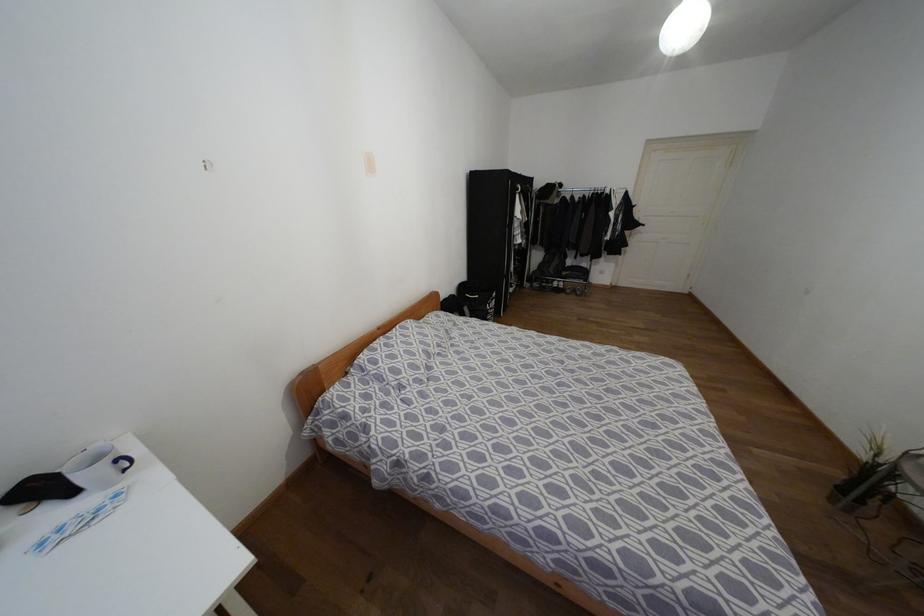
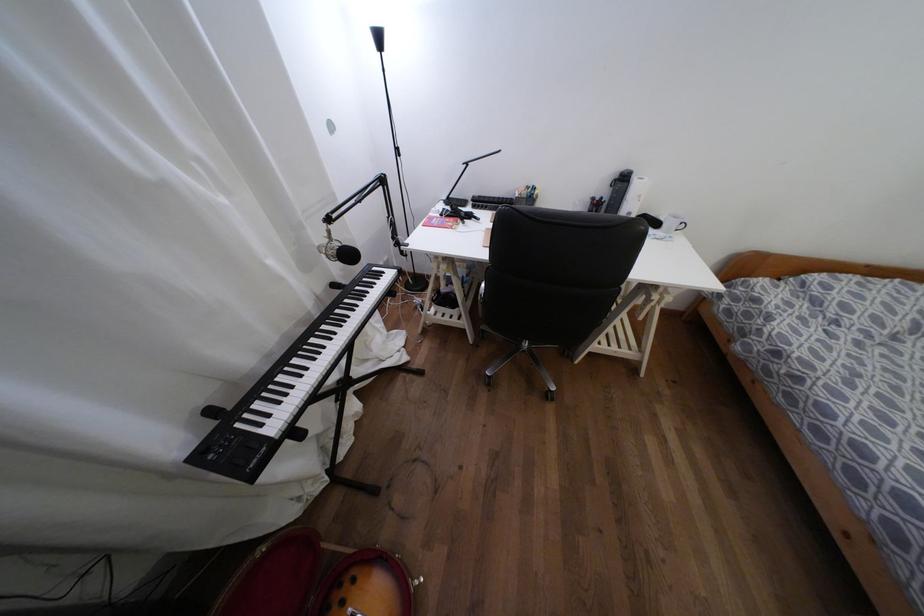
The point at (x=107, y=485) is marked in the first image. Where is the corresponding point in the second image?

(666, 232)